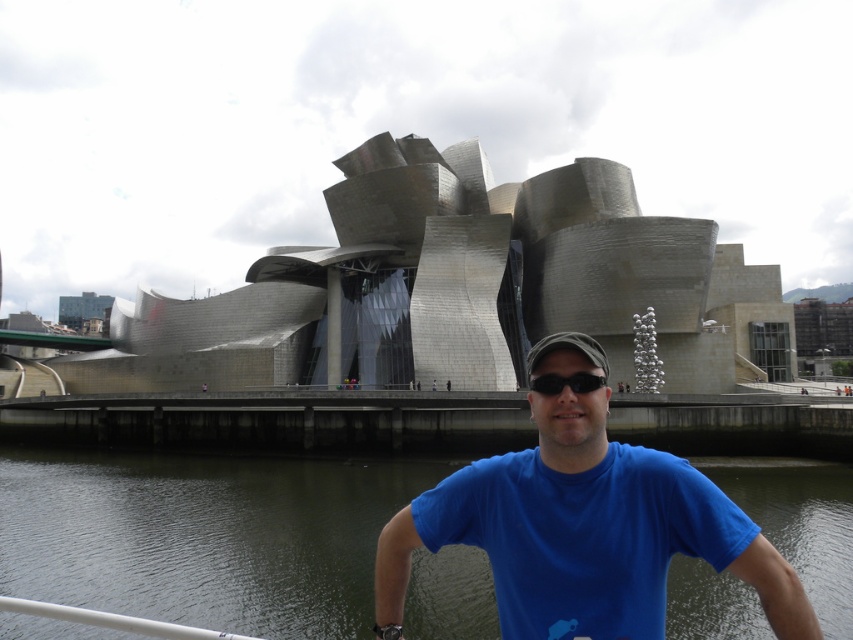
You are a photographer trying to capture the reflection of the Guggenheim Museum in the greenish water at lower center and the black matte sunglasses at center. Which object would require a wider angle to capture its reflection properly?

The greenish water at lower center has a larger size compared to the black matte sunglasses at center, so it would require a wider angle to capture its reflection properly.

You are a photographer trying to capture the man in front of the Guggenheim Museum. You notice the blue cotton shirt at center and the black matte sunglasses at center. Which object is located more to the left?

The blue cotton shirt at center is positioned on the left side of black matte sunglasses at center, so the blue cotton shirt at center is more to the left.